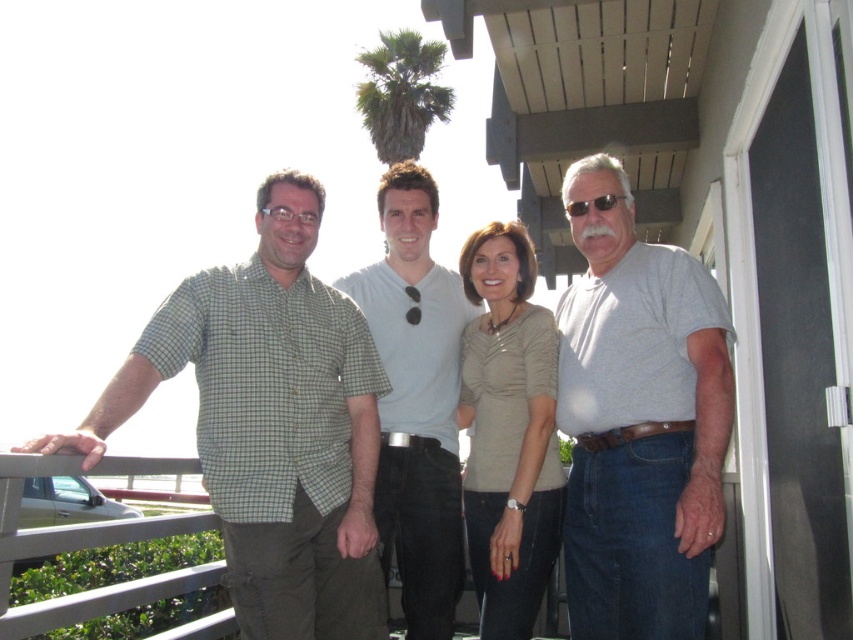
You are a photographer trying to capture a group photo of the green checkered shirt at left and the matte beige blouse at center. If you want to ensure both subjects are fully visible in the frame, which subject should you position closer to the camera to avoid cropping?

The green checkered shirt at left might be wider than matte beige blouse at center, so positioning the green checkered shirt at left closer to the camera would help ensure both subjects are fully visible without cropping.

You are trying to decide which of the two tops is taller in the image. You see the green checkered shirt at left and the matte beige blouse at center. Which one is taller?

The green checkered shirt at left is taller than the matte beige blouse at center.